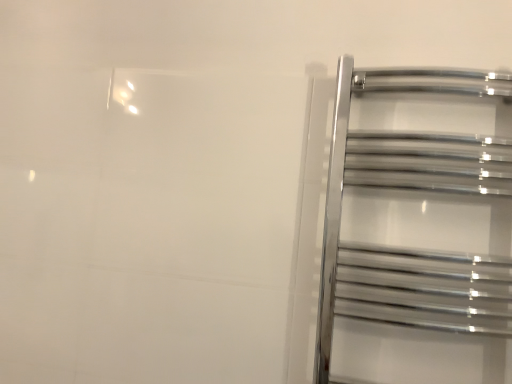
Identify the location of polished chrome towel rack at right. The width and height of the screenshot is (512, 384). (417, 229).

The image size is (512, 384). Describe the element at coordinates (417, 229) in the screenshot. I see `polished chrome towel rack at right` at that location.

In order to face polished chrome towel rack at right, should I rotate leftwards or rightwards?

Turn right by 22.421 degrees to look at polished chrome towel rack at right.

The height and width of the screenshot is (384, 512). I want to click on polished chrome towel rack at right, so click(x=417, y=229).